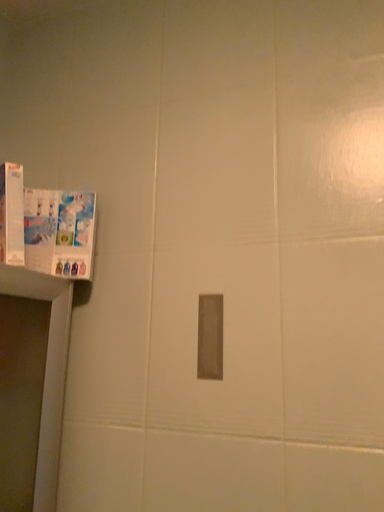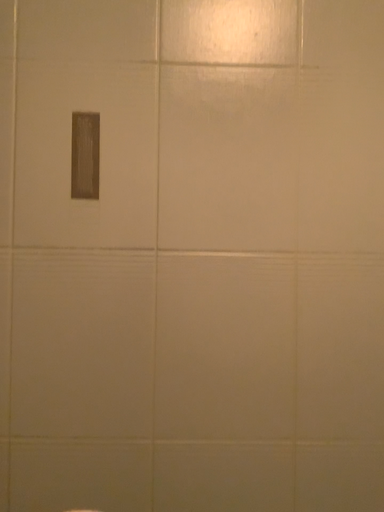
Question: How did the camera likely rotate when shooting the video?

Choices:
 (A) rotated downward
 (B) rotated upward

Answer: (A)